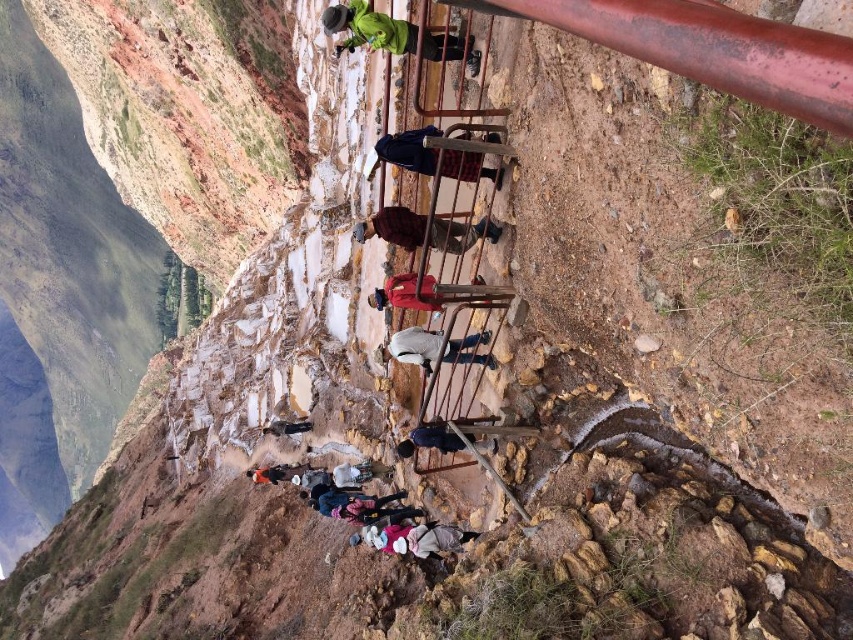
What do you see at coordinates (434, 348) in the screenshot? I see `white fabric jacket at center` at bounding box center [434, 348].

Which is in front, point (473, 356) or point (426, 547)?

Point (426, 547) is more forward.

Image resolution: width=853 pixels, height=640 pixels. I want to click on white fabric jacket at center, so click(x=434, y=348).

Between white fabric jacket at center and orange fabric bag at center, which one appears on the left side from the viewer's perspective?

orange fabric bag at center

Can you confirm if white fabric jacket at center is bigger than orange fabric bag at center?

Incorrect, white fabric jacket at center is not larger than orange fabric bag at center.

Where is `white fabric jacket at center`? The image size is (853, 640). white fabric jacket at center is located at coordinates (434, 348).

Is red cotton shirt at center shorter than white fabric jacket at center?

No.

Does red cotton shirt at center appear on the right side of white fabric jacket at center?

Yes, red cotton shirt at center is to the right of white fabric jacket at center.

Measure the distance between red cotton shirt at center and camera.

red cotton shirt at center is 37.98 meters away from camera.

Identify the location of red cotton shirt at center. This screenshot has height=640, width=853. (431, 292).